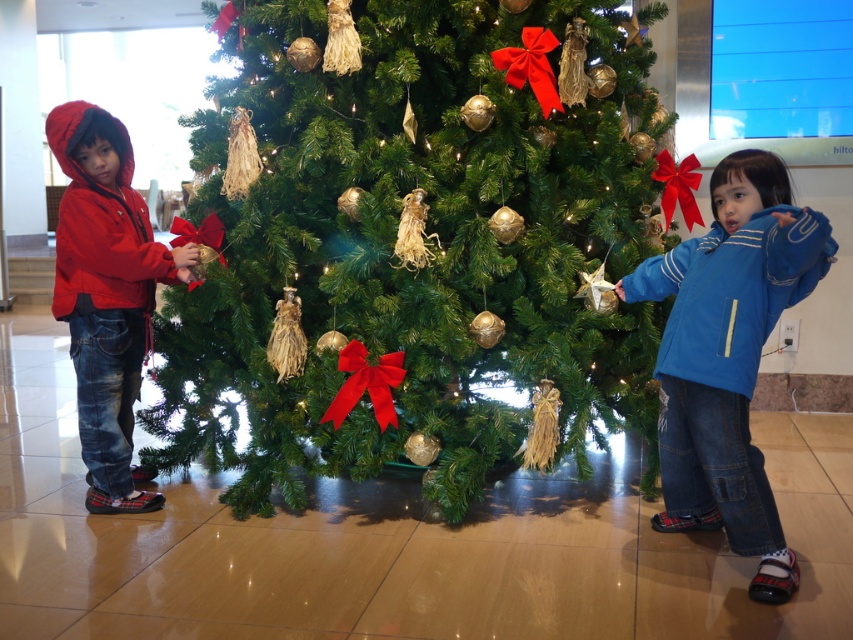
Which is in front, point (436, 45) or point (670, 353)?

Positioned in front is point (670, 353).

Does point (281, 177) lie behind point (746, 353)?

Yes, point (281, 177) is farther from viewer.

Image resolution: width=853 pixels, height=640 pixels. In order to click on green matte christmas tree at center in this screenshot , I will do `click(425, 244)`.

Which of these two, green matte christmas tree at center or matte red jacket at left, stands shorter?

With less height is matte red jacket at left.

Who is positioned more to the right, green matte christmas tree at center or matte red jacket at left?

From the viewer's perspective, green matte christmas tree at center appears more on the right side.

Identify the location of green matte christmas tree at center. (425, 244).

You are a GUI agent. You are given a task and a screenshot of the screen. Output one action in this format:
    pyautogui.click(x=<x>, y=<y>)
    Task: Click on the green matte christmas tree at center
    Image resolution: width=853 pixels, height=640 pixels.
    Given the screenshot: What is the action you would take?
    pyautogui.click(x=425, y=244)

Does blue fleece jacket at right have a larger size compared to matte red jacket at left?

Yes, blue fleece jacket at right is bigger than matte red jacket at left.

Which is behind, point (712, 195) or point (109, 467)?

The point (109, 467) is more distant.

The height and width of the screenshot is (640, 853). In order to click on blue fleece jacket at right in this screenshot , I will do `click(728, 355)`.